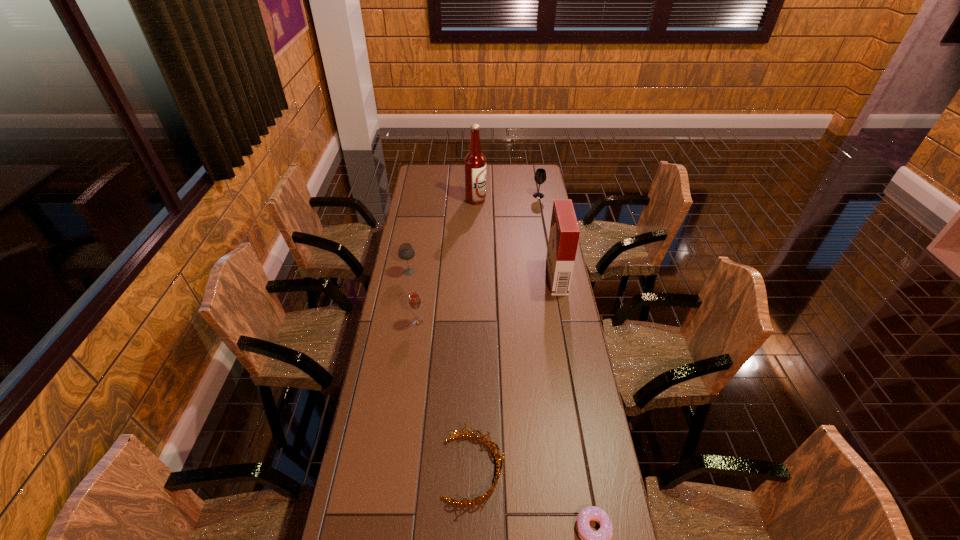
The image size is (960, 540). In order to click on alcohol in this screenshot , I will do `click(475, 162)`.

The image size is (960, 540). Find the location of `cigarette_case`. cigarette_case is located at coordinates (564, 233).

This screenshot has height=540, width=960. Find the location of `the farthest wineglass`. the farthest wineglass is located at coordinates (540, 176).

At what (x,y) coordinates should I click in order to perform the action: click on the fifth farthest object. Please return your answer as a coordinate pair (x, y). Looking at the image, I should click on (414, 300).

Find the location of a particular element. This screenshot has height=540, width=960. the nearest wineglass is located at coordinates (414, 300).

Find the location of a particular element. The width and height of the screenshot is (960, 540). the leftmost wineglass is located at coordinates pos(406,252).

Find the location of a particular element. This screenshot has height=540, width=960. the leftmost object is located at coordinates (406, 252).

The height and width of the screenshot is (540, 960). I want to click on tiara, so click(497, 455).

Locate an element on the screen. the second nearest object is located at coordinates (497, 455).

Where is `free spot located 0.230m on the label side of the tallest object`? The image size is (960, 540). free spot located 0.230m on the label side of the tallest object is located at coordinates (530, 200).